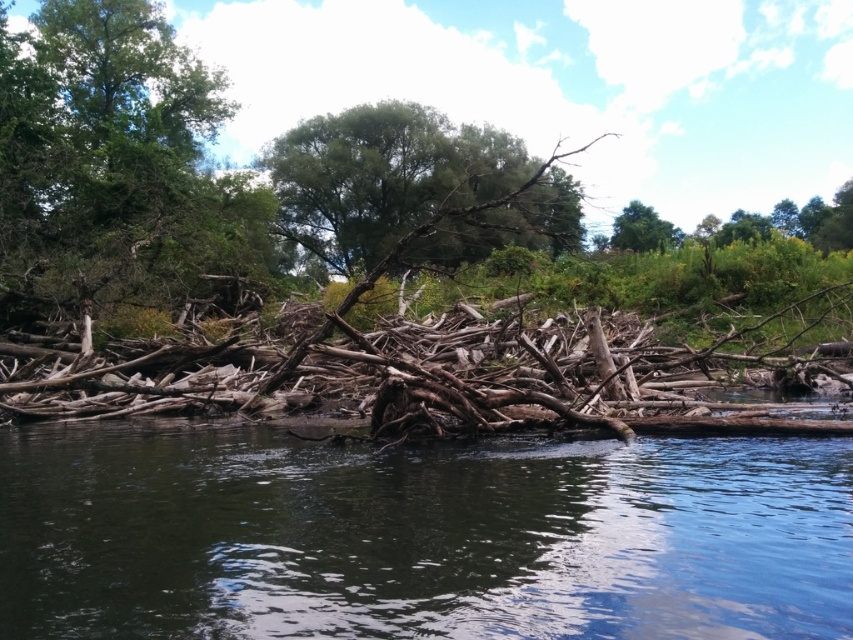
Which is in front, point (383, 328) or point (433, 125)?

Point (383, 328) is more forward.

In the scene shown: Which is below, brown rough driftwood at center or green leafy tree at center?

brown rough driftwood at center

Between point (595, 348) and point (354, 272), which one is positioned behind?

The point (354, 272) is behind.

Where is `brown rough driftwood at center`? The height and width of the screenshot is (640, 853). brown rough driftwood at center is located at coordinates (448, 380).

Between point (399, 134) and point (672, 244), which one is positioned behind?

The point (672, 244) is behind.

Who is shorter, green leafy tree at center or green leafy tree at upper center?

green leafy tree at upper center is shorter.

Identify the location of green leafy tree at center. (383, 177).

Is point (663, 237) farther from camera compared to point (637, 237)?

Yes.

Can you confirm if green leafy tree at upper right is wider than green leafy tree at upper center?

Yes.

Does point (798, 225) come behind point (642, 221)?

No.

Locate an element on the screen. green leafy tree at upper right is located at coordinates (788, 221).